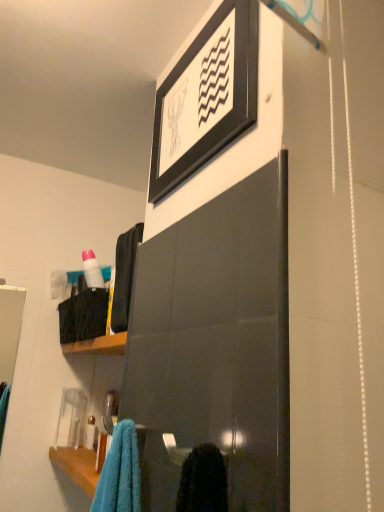
Question: Considering their positions, is black matte picture frame at upper center located in front of or behind pink glossy lotion at upper left?

Choices:
 (A) behind
 (B) front

Answer: (B)

Question: Is black matte picture frame at upper center bigger or smaller than pink glossy lotion at upper left?

Choices:
 (A) small
 (B) big

Answer: (B)

Question: Is black matte picture frame at upper center taller or shorter than pink glossy lotion at upper left?

Choices:
 (A) short
 (B) tall

Answer: (B)

Question: Is point (82, 254) positioned closer to the camera than point (233, 130)?

Choices:
 (A) farther
 (B) closer

Answer: (A)

Question: From the image's perspective, is pink glossy lotion at upper left positioned above or below black matte picture frame at upper center?

Choices:
 (A) below
 (B) above

Answer: (A)

Question: Is pink glossy lotion at upper left situated inside black matte picture frame at upper center or outside?

Choices:
 (A) outside
 (B) inside

Answer: (A)

Question: Based on their positions, is pink glossy lotion at upper left located to the left or right of black matte picture frame at upper center?

Choices:
 (A) left
 (B) right

Answer: (A)